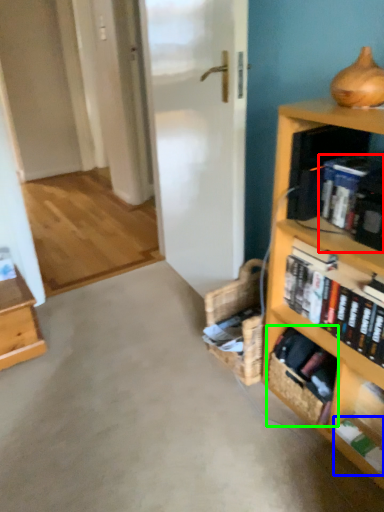
Question: Estimate the real-world distances between objects in this image. Which object is closer to book (highlighted by a red box), book (highlighted by a blue box) or basket (highlighted by a green box)?

Choices:
 (A) book
 (B) basket

Answer: (B)